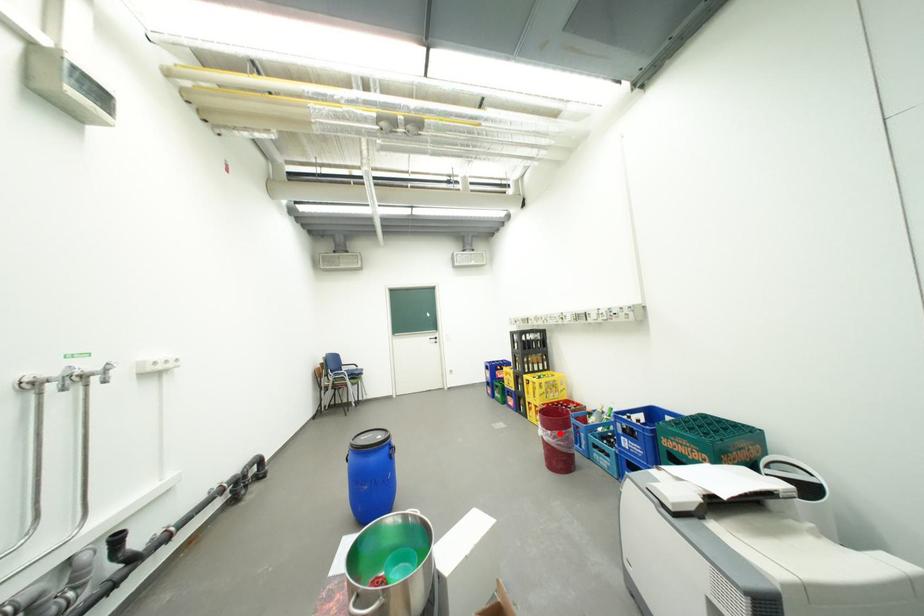
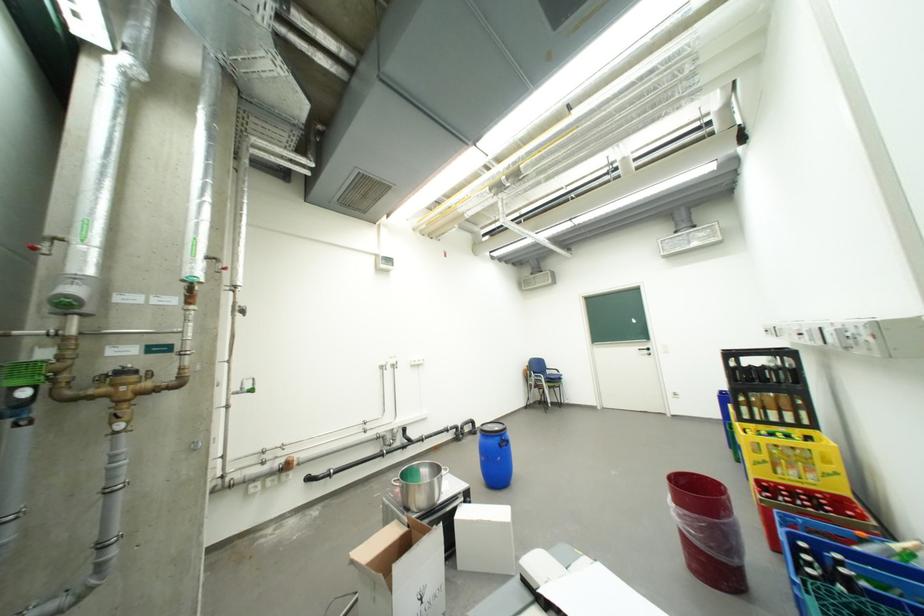
Find the pixel in the second image that matches the highlighted location in the first image.

(685, 507)